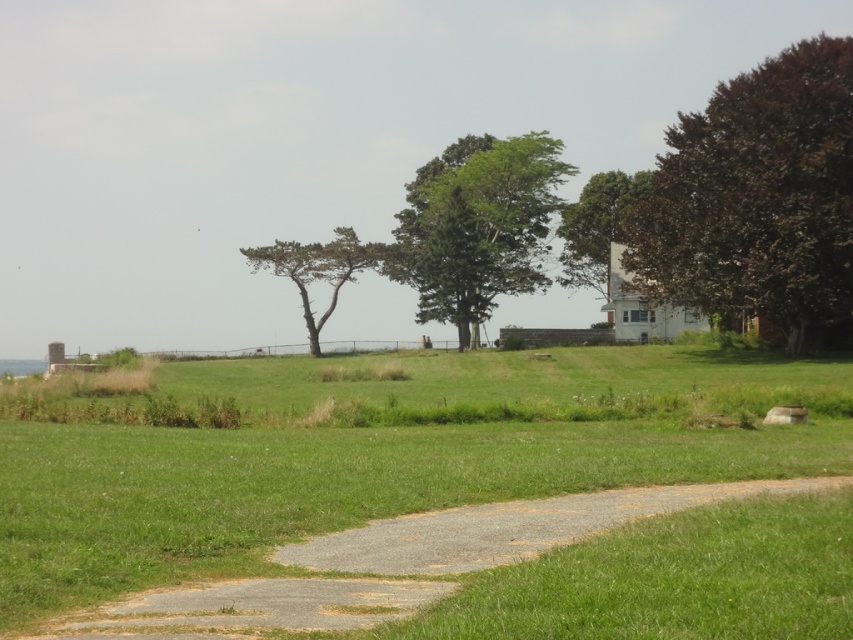
Based on the scene description, which tree, the dark brown textured tree at upper right or the green leafy tree at upper center, has a greater width?

The dark brown textured tree at upper right might be wider than the green leafy tree at upper center according to the description.

You are planning to plant a new tree in this landscape. The dark brown textured tree at upper right and the green textured tree at center are already present. Which tree would cast a longer shadow during midday when the sun is directly overhead?

The dark brown textured tree at upper right is much taller than the green textured tree at center, so it would cast a longer shadow during midday when the sun is directly overhead.

You are standing at the entrance of the path and see the green grass at center and the green leafy tree at upper center. Which object is closer to you?

The green grass at center is closer to you because it is positioned to the left of the green leafy tree at upper center, indicating it is in front of the tree.